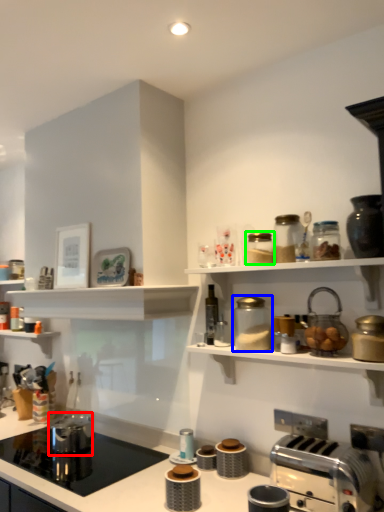
Question: Which object is the farthest from appliance (highlighted by a red box)? Choose among these: appliance (highlighted by a blue box) or appliance (highlighted by a green box).

Choices:
 (A) appliance
 (B) appliance

Answer: (B)